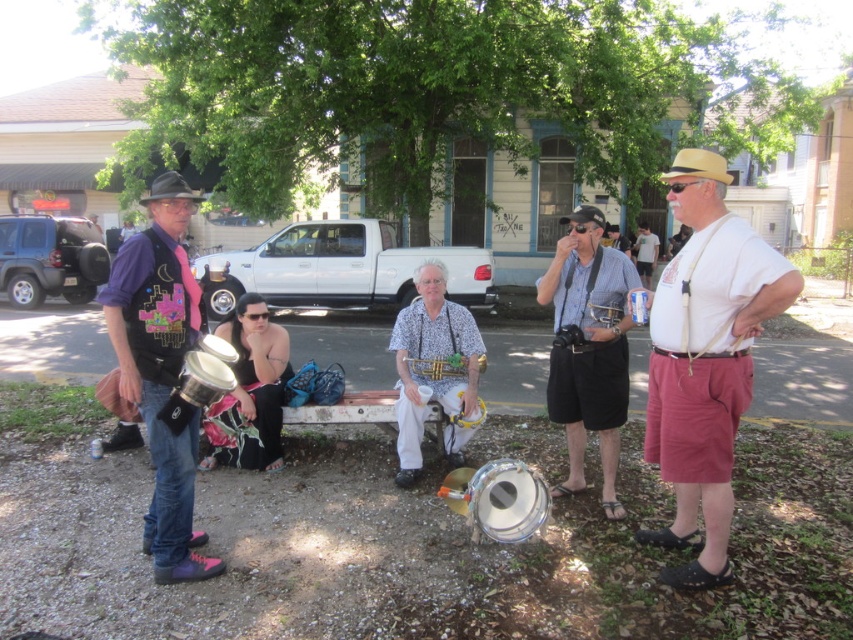
You are a photographer trying to capture a photo of the metallic drum at left without including the shiny purple shirt at left in the frame. Based on their positions, is this possible?

The shiny purple shirt at left is to the left of the metallic drum at left, so if you position yourself to the right side of the metallic drum at left, you can frame the shot to exclude the shirt.

You are a photographer trying to capture a clear photo of the shiny purple shirt at left. However, the metallic drum at left is blocking your view. Can you move the drum to the right to get a better shot?

The shiny purple shirt at left is positioned under the metallic drum at left, so moving the drum to the right would allow you to see the shirt without obstruction.

You are a photographer setting up for a group photo at the park. You want to ensure the silver metallic drum at lower center is centered in your shot. Given its coordinates are at point 0.781, 0.585, where should you position your camera relative to the bench?

The silver metallic drum at lower center is located at point (498, 502), so to center it in your shot, position your camera directly facing the drum at those coordinates, ensuring it is in the center of your frame.